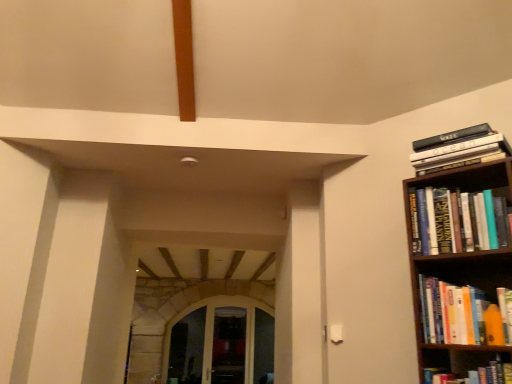
Question: Based on their positions, is transparent glass door at center, which ranks as the second glass door in left-to-right order, located to the left or right of hardcover book at upper right, which ranks as the 3th book in bottom-to-top order?

Choices:
 (A) right
 (B) left

Answer: (B)

Question: Considering their positions, is transparent glass door at center, which ranks as the second glass door in left-to-right order, located in front of or behind hardcover book at upper right, which ranks as the 3th book in bottom-to-top order?

Choices:
 (A) behind
 (B) front

Answer: (A)

Question: Estimate the real-world distances between objects in this image. Which object is closer to the hardcover book at upper right, the second book in the top-to-bottom sequence?

Choices:
 (A) transparent glass door at center, which ranks as the second glass door in left-to-right order
 (B) hardcover book at right, arranged as the first book when ordered from the bottom
 (C) orange matte bookshelf at right, which is the 3th book in top-to-bottom order
 (D) clear glass door at center, which is the 2th glass door in right-to-left order
 (E) hardcover books at upper right, marked as the 4th book in a bottom-to-top arrangement

Answer: (E)

Question: Which is nearer to the clear glass door at center, which is the 2th glass door in right-to-left order?

Choices:
 (A) hardcover books at upper right, marked as the 4th book in a bottom-to-top arrangement
 (B) transparent glass door at center, acting as the first glass door starting from the right
 (C) orange matte bookshelf at right, which is the 3th book in top-to-bottom order
 (D) hardcover book at upper right, which ranks as the 3th book in bottom-to-top order
 (E) hardcover book at right, which is counted as the fourth book, starting from the top

Answer: (B)